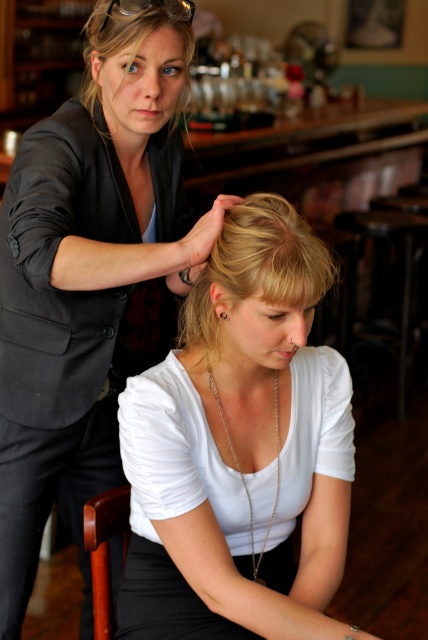
Is point (21, 164) positioned before point (291, 250)?

That is False.

Is matte black suit at upper left thinner than blonde hair at center?

Incorrect, matte black suit at upper left's width is not less than blonde hair at center's.

Who is more forward, (109, 412) or (269, 241)?

Positioned in front is point (269, 241).

This screenshot has height=640, width=428. In order to click on matte black suit at upper left in this screenshot , I will do `click(89, 275)`.

This screenshot has width=428, height=640. Find the location of `white matte hair at center`. white matte hair at center is located at coordinates (240, 448).

Can you confirm if white matte hair at center is thinner than blonde hair at center?

Incorrect, white matte hair at center's width is not less than blonde hair at center's.

Which is in front, point (169, 524) or point (237, 246)?

Point (237, 246)

This screenshot has width=428, height=640. In order to click on white matte hair at center in this screenshot , I will do `click(240, 448)`.

Which is above, blonde hair at center or blonde hair at upper left?

blonde hair at upper left is higher up.

Is blonde hair at center shorter than blonde hair at upper left?

Correct, blonde hair at center is not as tall as blonde hair at upper left.

Which is in front, point (276, 241) or point (174, 1)?

Point (276, 241) is in front.

At what (x,y) coordinates should I click in order to perform the action: click on blonde hair at center. Please return your answer as a coordinate pair (x, y). Image resolution: width=428 pixels, height=640 pixels. Looking at the image, I should click on (256, 266).